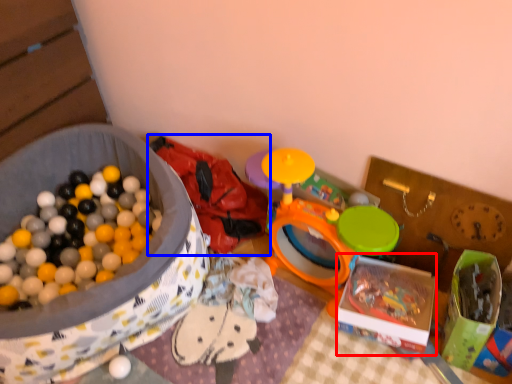
Question: Among these objects, which one is nearest to the camera, storage box (highlighted by a red box) or toy (highlighted by a blue box)?

Choices:
 (A) storage box
 (B) toy

Answer: (A)